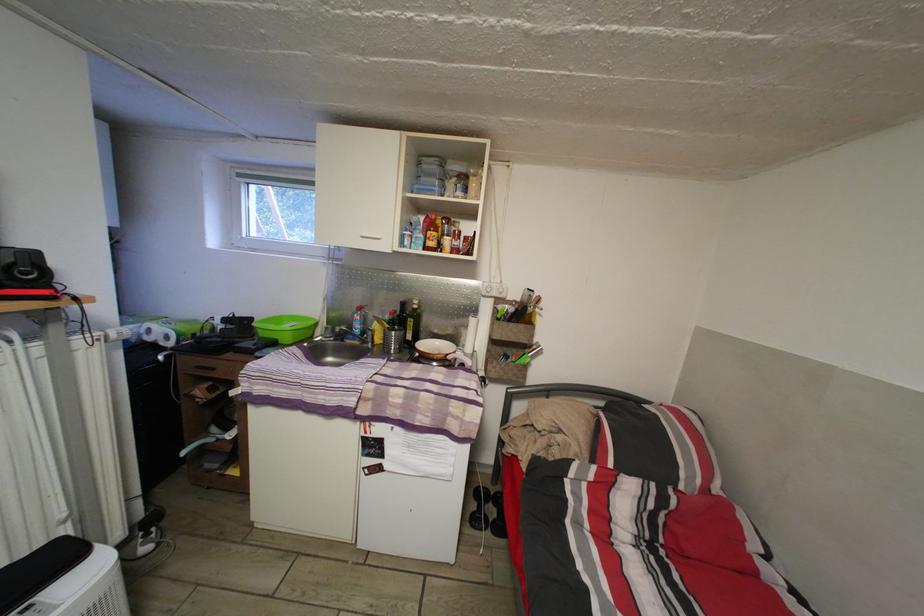
Identify the location of white cabinet handle. (371, 238).